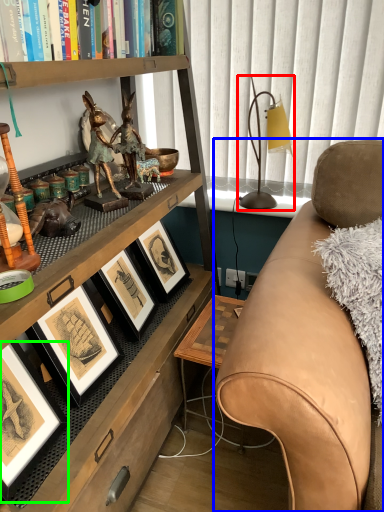
Question: Estimate the real-world distances between objects in this image. Which object is closer to table lamp (highlighted by a red box), studio couch (highlighted by a blue box) or picture frame (highlighted by a green box)?

Choices:
 (A) studio couch
 (B) picture frame

Answer: (A)